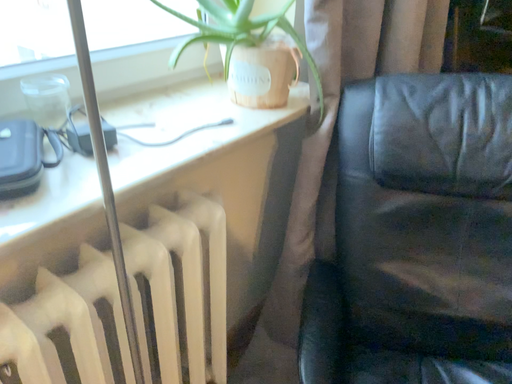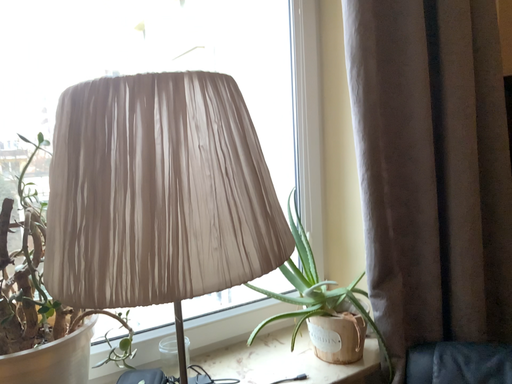
Question: How did the camera likely rotate when shooting the video?

Choices:
 (A) rotated downward
 (B) rotated upward

Answer: (B)